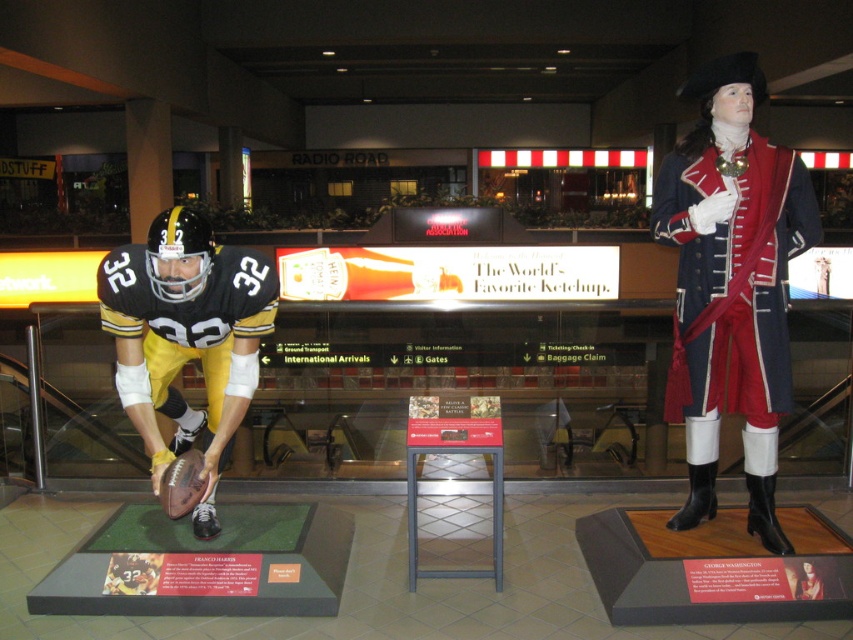
You are a security guard in the museum. You need to check the blue wool coat at right located at point (730, 285). Is this coat positioned to the left or right of the football mannequin in the display?

The blue wool coat at right is positioned to the right of the football mannequin in the display.

You are a security guard in the museum and need to check the height of both the blue wool coat at right and the matte black uniform at left. Which one is taller?

The blue wool coat at right is taller than the matte black uniform at left.

You are a security guard in the museum and need to check the distance between the blue wool coat at right and the matte black uniform at left. The security protocol requires that all items in the display must be at least 5 feet apart for safety. Can you confirm if the distance meets the requirement?

The distance between the blue wool coat at right and the matte black uniform at left is 5.17 feet, which exceeds the minimum requirement of 5 feet. Therefore, the distance meets the safety protocol.